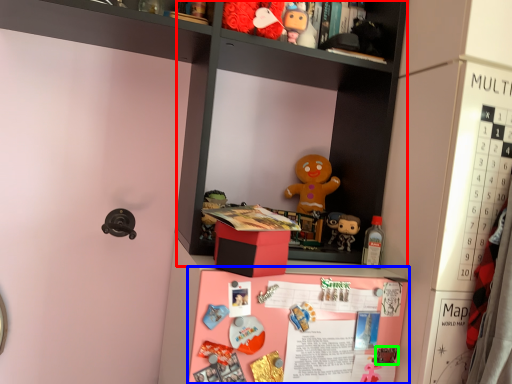
Question: Which object is positioned farthest from cabinet (highlighted by a red box)? Select from table (highlighted by a blue box) and toy (highlighted by a green box).

Choices:
 (A) table
 (B) toy

Answer: (B)